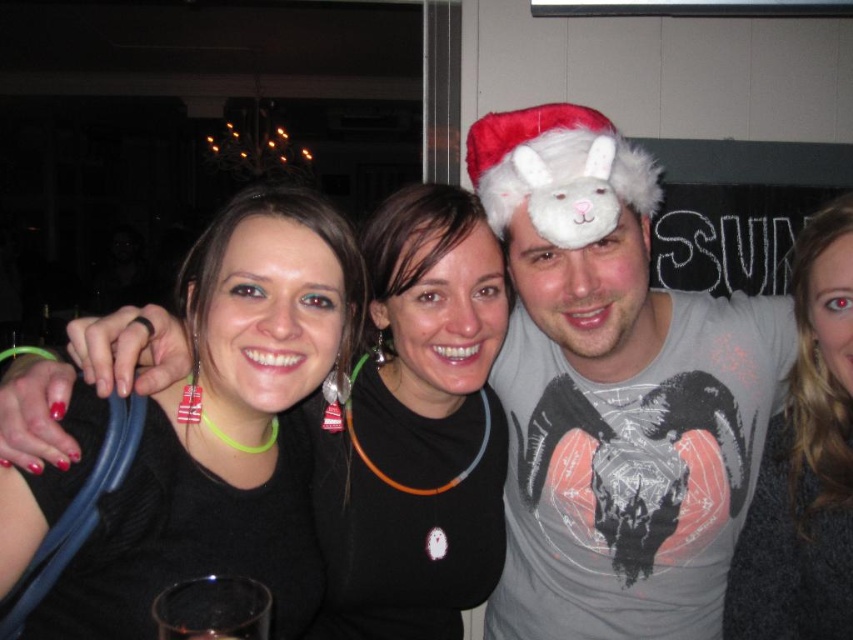
Who is more forward, (352,540) or (570,195)?

Point (570,195) is more forward.

Looking at this image, can you confirm if black fabric at center is thinner than fuzzy white hat at center?

No, black fabric at center is not thinner than fuzzy white hat at center.

Between point (355, 548) and point (590, 140), which one is positioned behind?

The point (355, 548) is more distant.

The height and width of the screenshot is (640, 853). Identify the location of black fabric at center. (x=418, y=429).

Can you confirm if gray matte t-shirt at center is positioned below fuzzy white hat at center?

Yes, gray matte t-shirt at center is below fuzzy white hat at center.

Where is `gray matte t-shirt at center`? This screenshot has width=853, height=640. gray matte t-shirt at center is located at coordinates (614, 392).

At what (x,y) coordinates should I click in order to perform the action: click on gray matte t-shirt at center. Please return your answer as a coordinate pair (x, y). This screenshot has height=640, width=853. Looking at the image, I should click on (614, 392).

Is gray matte t-shirt at center smaller than black fabric at center?

No, gray matte t-shirt at center is not smaller than black fabric at center.

Is gray matte t-shirt at center to the left of black fabric at center from the viewer's perspective?

No, gray matte t-shirt at center is not to the left of black fabric at center.

Who is more forward, (x=659, y=458) or (x=430, y=595)?

Point (x=659, y=458) is in front.

Where is `gray matte t-shirt at center`? Image resolution: width=853 pixels, height=640 pixels. gray matte t-shirt at center is located at coordinates (614, 392).